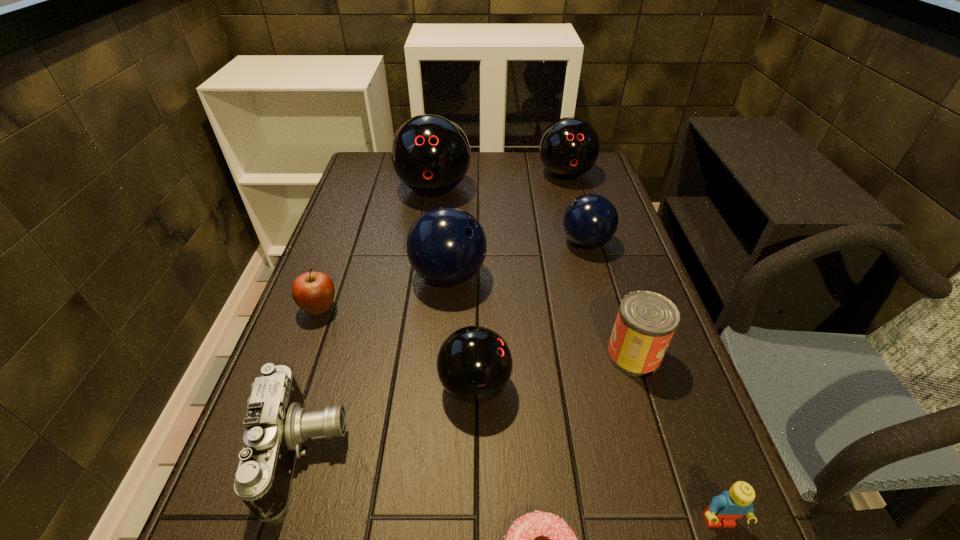
Image resolution: width=960 pixels, height=540 pixels. Identify the location of vacant space located on the front of the red apple. pos(299,368).

Identify the location of bowling ball present at the left edge. (430, 153).

You are a GUI agent. You are given a task and a screenshot of the screen. Output one action in this format:
    pyautogui.click(x=<x>, y=<y>)
    Task: Click on the camera at the left edge
    This screenshot has width=960, height=540.
    Given the screenshot: What is the action you would take?
    pyautogui.click(x=277, y=423)

At what (x,y) coordinates should I click in order to perform the action: click on apple present at the left edge. Please return your answer as a coordinate pair (x, y). This screenshot has width=960, height=540. Looking at the image, I should click on (313, 292).

Locate an element on the screen. can that is at the right edge is located at coordinates (646, 321).

Where is `Lego that is at the right edge`? Image resolution: width=960 pixels, height=540 pixels. Lego that is at the right edge is located at coordinates (725, 508).

In order to click on object located in the far left corner section of the desktop in this screenshot , I will do `click(430, 153)`.

Identify the location of object located in the far right corner section of the desktop. This screenshot has width=960, height=540. (569, 147).

At what (x,y) coordinates should I click in order to perform the action: click on free space at the far edge. Please return your answer as a coordinate pair (x, y). This screenshot has height=540, width=960. Looking at the image, I should click on (516, 164).

The image size is (960, 540). Identify the location of vacant space at the left edge of the desktop. (350, 235).